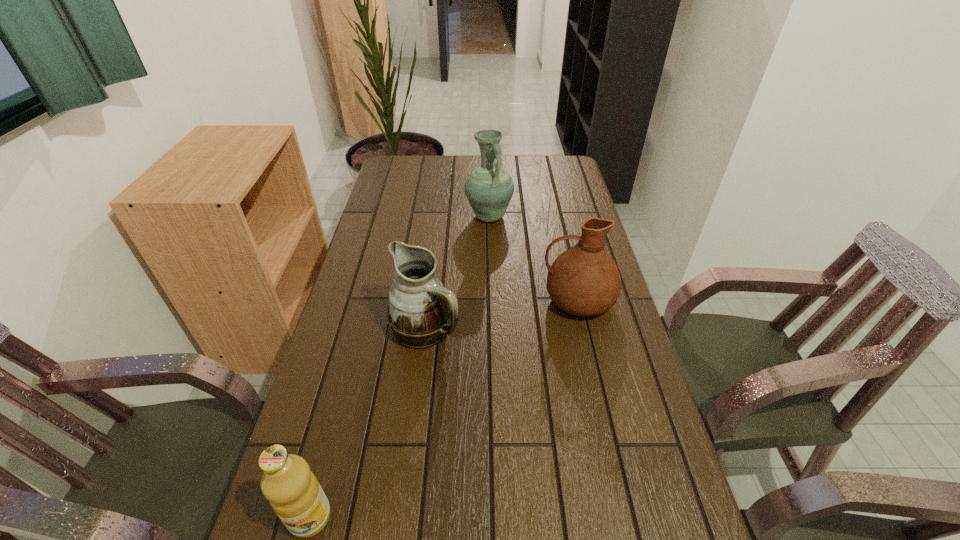
This screenshot has width=960, height=540. I want to click on vacant area at the right edge of the desktop, so 550,237.

The height and width of the screenshot is (540, 960). I want to click on vacant space at the far left corner of the desktop, so click(x=410, y=163).

In the image, there is a desktop. What are the coordinates of `vacant space at the far right corner` in the screenshot? It's located at (546, 161).

Locate an element on the screen. The height and width of the screenshot is (540, 960). empty location between the farthest pitcher and the rightmost pitcher is located at coordinates (533, 258).

Locate an element on the screen. vacant space that's between the rightmost object and the farthest pitcher is located at coordinates 533,258.

The image size is (960, 540). In order to click on empty space that is in between the rightmost object and the farthest pitcher in this screenshot , I will do `click(533, 258)`.

Locate an element on the screen. The height and width of the screenshot is (540, 960). the second closest object to the olive oil is located at coordinates (584, 280).

Where is `object identified as the second closest to the rightmost pitcher`? This screenshot has width=960, height=540. object identified as the second closest to the rightmost pitcher is located at coordinates point(489,188).

Select which pitcher is the second closest to the farthest object. Please provide its 2D coordinates. Your answer should be formatted as a tuple, i.e. [(x, y)], where the tuple contains the x and y coordinates of a point satisfying the conditions above.

[(419, 309)]

You are a GUI agent. You are given a task and a screenshot of the screen. Output one action in this format:
    pyautogui.click(x=<x>, y=<y>)
    Task: Click on the pitcher that stands as the second closest to the rightmost pitcher
    
    Given the screenshot: What is the action you would take?
    pyautogui.click(x=489, y=188)